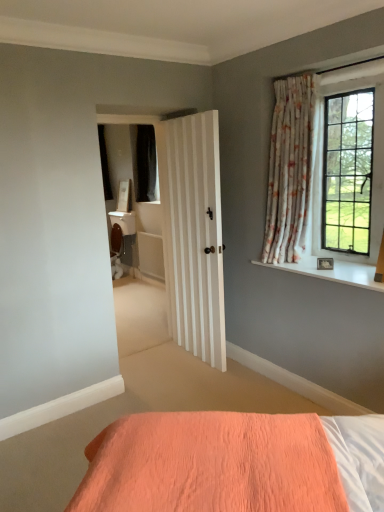
The width and height of the screenshot is (384, 512). What are the coordinates of `blank area beneath floral fabric curtain at upper right (from a real-world perspective)` in the screenshot? It's located at (298, 260).